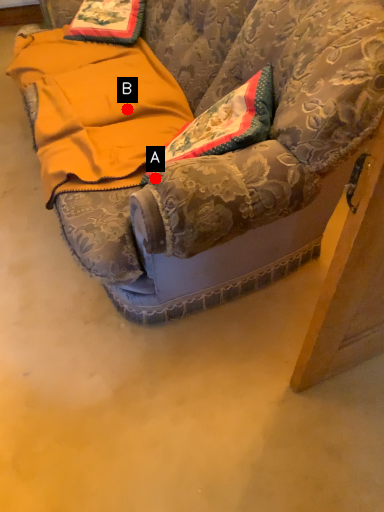
Question: Two points are circled on the image, labeled by A and B beside each circle. Which point appears farthest from the camera in this image?

Choices:
 (A) A is further
 (B) B is further

Answer: (B)